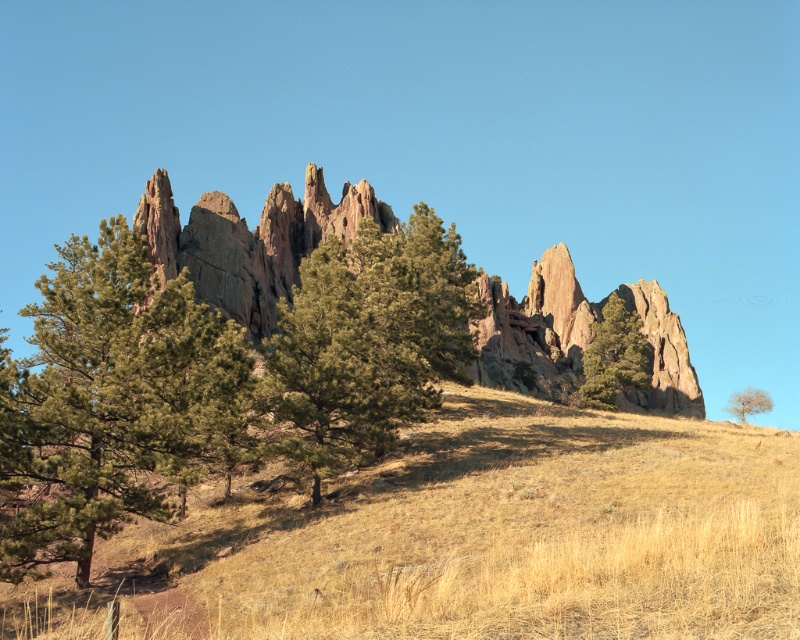
Who is shorter, green textured pine tree at left or smooth brown tree at right?

smooth brown tree at right

Which is above, green textured pine tree at left or smooth brown tree at right?

green textured pine tree at left is above.

Find the location of a particular element. This screenshot has height=640, width=800. green textured pine tree at left is located at coordinates (112, 401).

Is point (602, 394) closer to viewer compared to point (760, 394)?

That is True.

Which is behind, point (616, 381) or point (754, 388)?

The point (754, 388) is behind.

Is point (588, 401) positioned behind point (748, 410)?

No, it is not.

Find the location of a particular element. Image resolution: width=800 pixels, height=640 pixels. green textured tree at center is located at coordinates 614,355.

Can you confirm if dry grass at center is smaller than smooth brown tree at right?

Yes, dry grass at center is smaller than smooth brown tree at right.

Who is positioned more to the left, dry grass at center or smooth brown tree at right?

dry grass at center is more to the left.

Between point (584, 566) and point (736, 396), which one is positioned in front?

Point (584, 566) is in front.

Locate an element on the screen. The image size is (800, 640). dry grass at center is located at coordinates (470, 538).